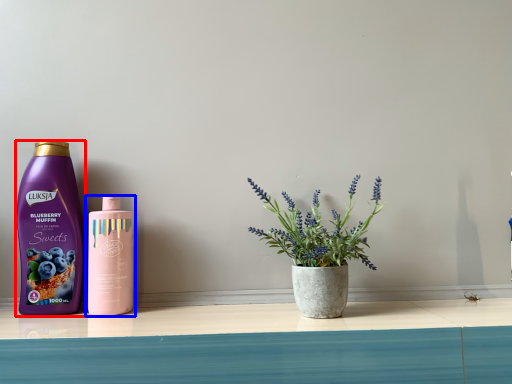
Question: Which point is further to the camera, bottle (highlighted by a red box) or bottle (highlighted by a blue box)?

Choices:
 (A) bottle
 (B) bottle

Answer: (A)